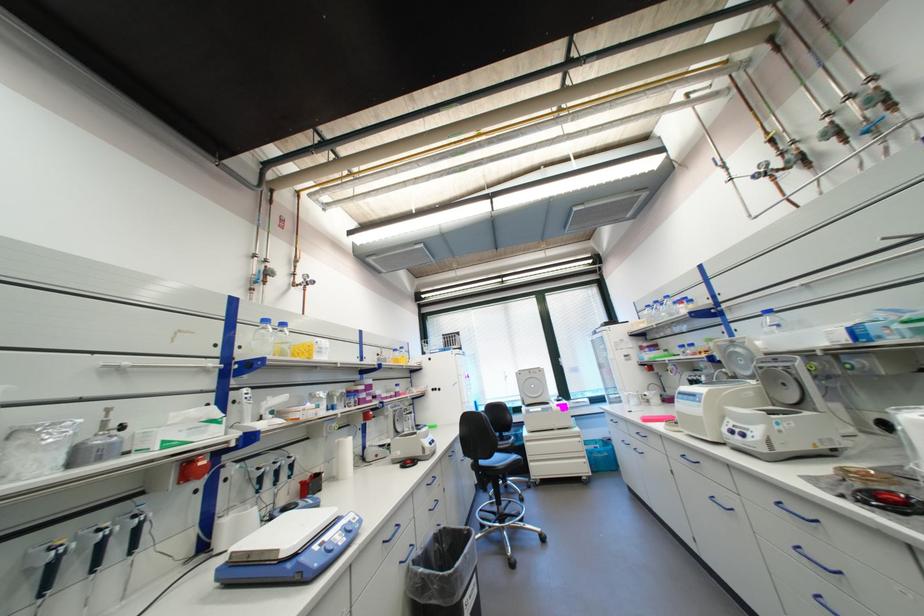
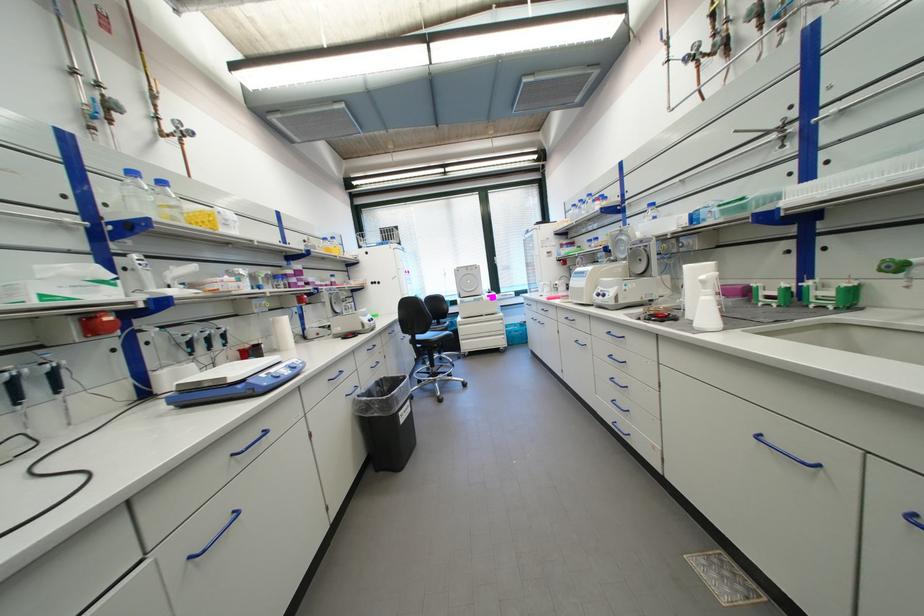
The point at (x=490, y=463) is marked in the first image. Where is the corresponding point in the second image?

(427, 338)